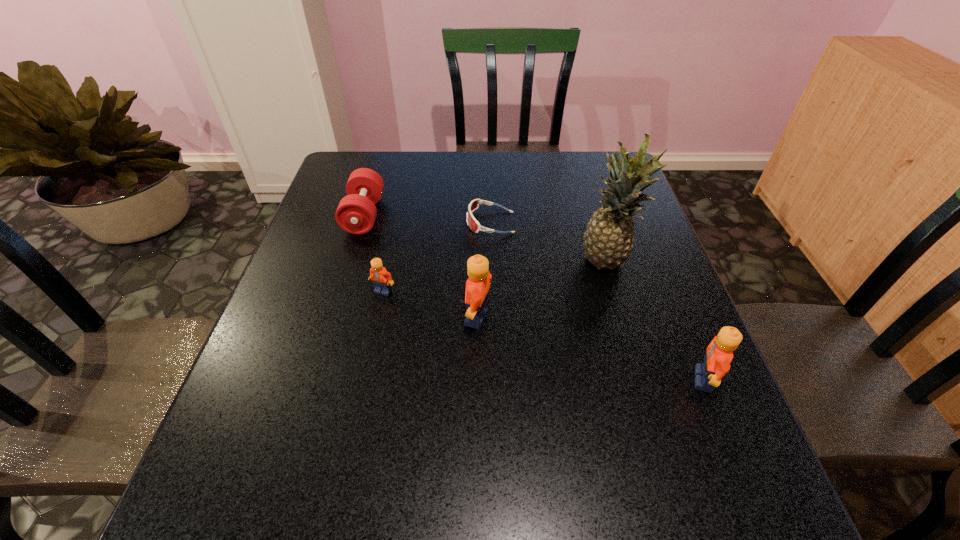
You are a GUI agent. You are given a task and a screenshot of the screen. Output one action in this format:
    pyautogui.click(x=<x>, y=<y>)
    Task: Click on the second object from left to right
    This screenshot has height=540, width=960.
    Given the screenshot: What is the action you would take?
    pyautogui.click(x=381, y=279)

Find the location of `the third nearest object`. the third nearest object is located at coordinates (381, 279).

The image size is (960, 540). What are the coordinates of `the second Lego from left to right` in the screenshot? It's located at (478, 284).

Identify the location of the second nearest object. This screenshot has width=960, height=540. (478, 284).

Find the location of `the nearest Lego`. the nearest Lego is located at coordinates (719, 353).

Where is `the second tallest Lego`? The width and height of the screenshot is (960, 540). the second tallest Lego is located at coordinates (719, 353).

Where is `dumbbell`? This screenshot has height=540, width=960. dumbbell is located at coordinates (356, 212).

Identify the location of the second object from right to left. (608, 239).

I want to click on pineapple, so click(608, 239).

The image size is (960, 540). I want to click on goggles, so click(474, 225).